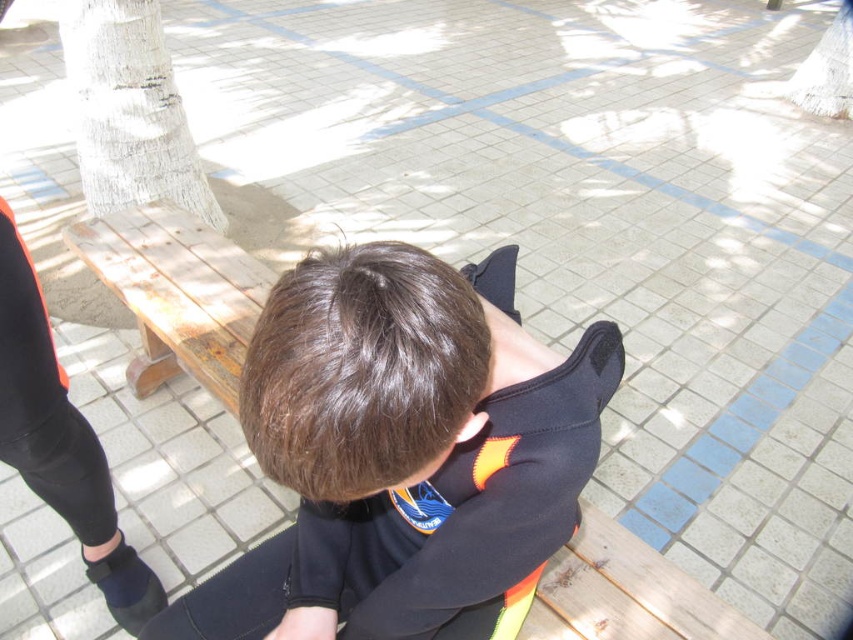
Does black matte jacket at center have a greater height compared to rusty wood bench at left?

No.

Is point (334, 292) closer to viewer compared to point (154, 275)?

That is True.

Image resolution: width=853 pixels, height=640 pixels. I want to click on black matte jacket at center, so click(x=404, y=452).

Where is `black matte jacket at center`? This screenshot has height=640, width=853. black matte jacket at center is located at coordinates (404, 452).